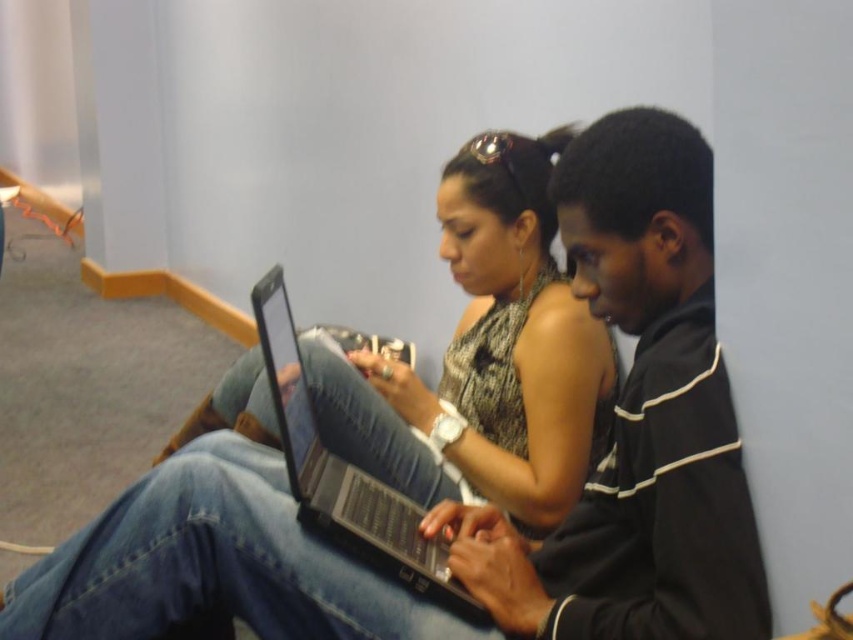
You are a delivery person who needs to place a small package on the nearest available surface to the matte black laptop at center. Which surface would you choose?

The nearest available surface to the matte black laptop at center would be the surface where the laptop is already placed, but since the laptop is occupying that space, the next closest surface would depend on the surrounding furniture not explicitly mentioned here. However, based on the provided information, there is no other surface specified, so the package cannot be placed nearby.

You are a delivery person who needs to pack two laptops, the matte black laptop at center and the black matte laptop at center, into a box. The box can only fit the larger of the two. Which laptop should you choose to place in the box?

The matte black laptop at center has a greater width than the black matte laptop at center, so you should choose the matte black laptop at center to place in the box since it is the larger one.

You are a technician trying to fix two laptops. You see the matte black laptop at center and the black matte laptop at center. Are the two laptops positioned close enough for you to easily pass a USB cable between them without unplugging any existing cables?

The distance between the matte black laptop at center and the black matte laptop at center is 10.68 inches. Since the distance is relatively small, you can easily pass a USB cable between them without needing to move either laptop.